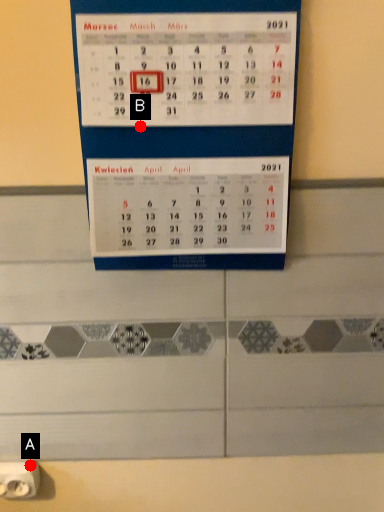
Question: Two points are circled on the image, labeled by A and B beside each circle. Which point is farther from the camera taking this photo?

Choices:
 (A) A is further
 (B) B is further

Answer: (A)